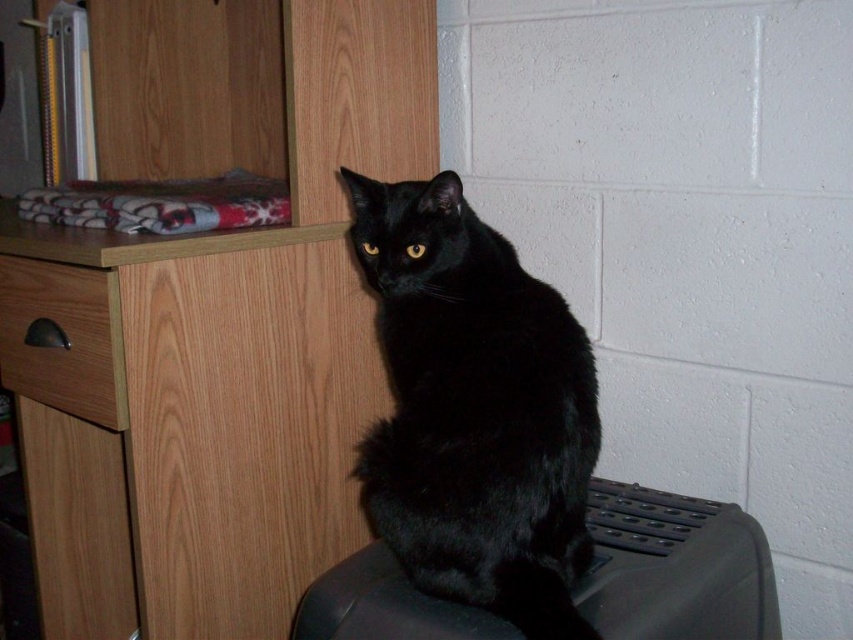
You are trying to clean under the black plastic swivel chair at lower right. Can you reach the area under it without moving the black fur cat at center?

The black fur cat at center is positioned over the black plastic swivel chair at lower right, so you cannot reach the area under the chair without moving the cat.

You are organizing a space and need to move the black fur cat at center to the left side of the room. If the black plastic swivel chair at lower right is in the way, can you move the cat around it?

The black fur cat at center is in front of the black plastic swivel chair at lower right, so the chair is behind the cat. Therefore, you can move the cat to the left side of the room without needing to move the chair first.